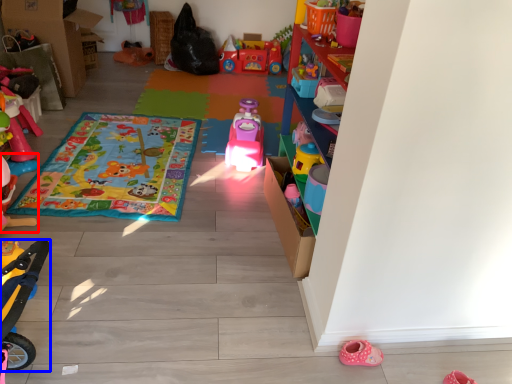
Question: Which point is closer to the camera, toy (highlighted by a red box) or toy (highlighted by a blue box)?

Choices:
 (A) toy
 (B) toy

Answer: (B)